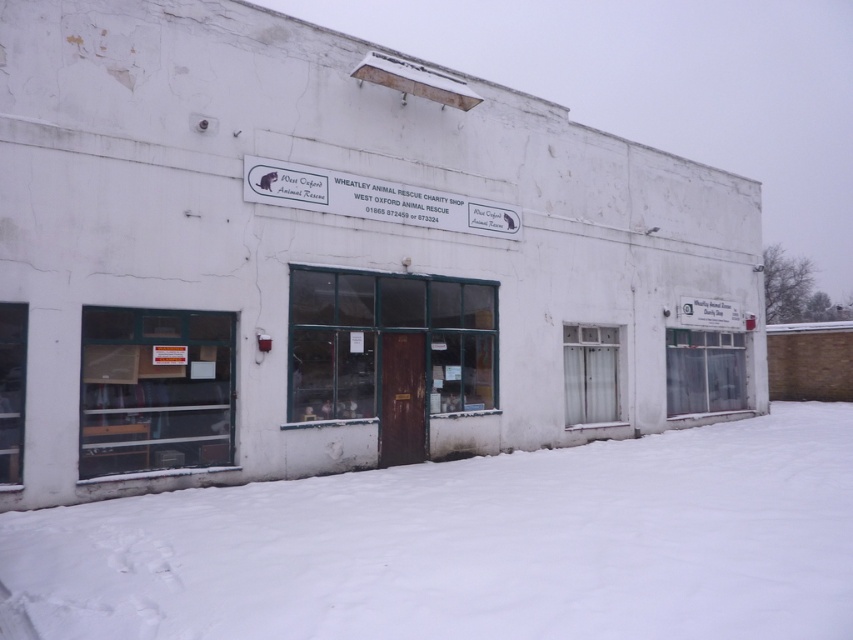
You are standing in front of the Wheatley Animal Rescue Charity Shop and notice the white powdery snow at lower center and the clear glass shelves at lower left. Which object is nearer to you?

The white powdery snow at lower center is closer to the viewer than the clear glass shelves at lower left.

You are a customer entering the Wheatley Animal Rescue Charity Shop. You see clear glass shelves at lower left and a white plastic sign at upper center. Which object is smaller in size?

The clear glass shelves at lower left is smaller than the white plastic sign at upper center.